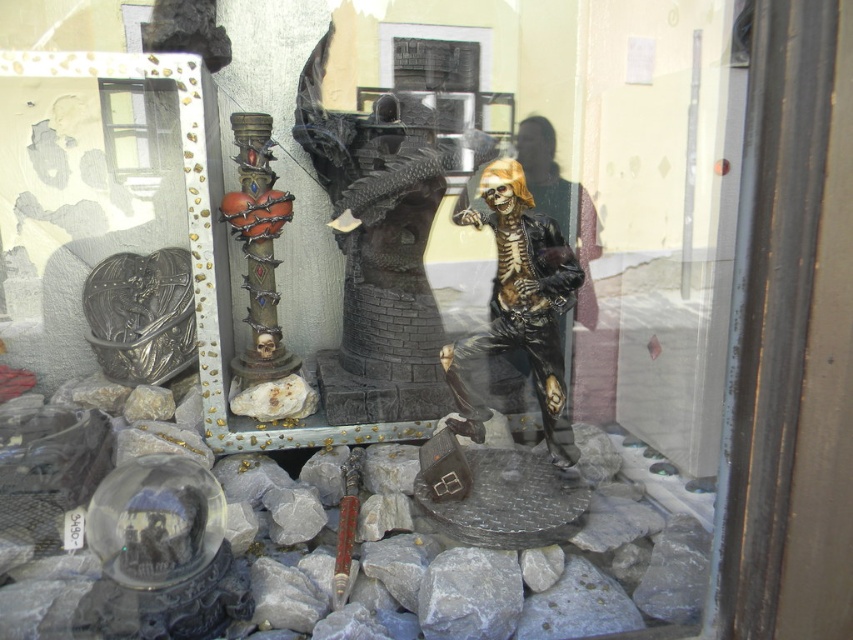
How much distance is there between silver metallic heart at left and shiny metallic column at center?

A distance of 29.37 centimeters exists between silver metallic heart at left and shiny metallic column at center.

Is point (137, 308) positioned after point (254, 116)?

That is True.

Where is `silver metallic heart at left`? The width and height of the screenshot is (853, 640). silver metallic heart at left is located at coordinates (141, 314).

Can you confirm if shiny gold skeleton at center is wider than silver metallic heart at left?

No, shiny gold skeleton at center is not wider than silver metallic heart at left.

Can you confirm if shiny gold skeleton at center is thinner than silver metallic heart at left?

Yes.

Which is behind, point (511, 212) or point (149, 328)?

The point (149, 328) is behind.

Identify the location of shiny gold skeleton at center. This screenshot has height=640, width=853. (519, 307).

Based on the photo, is shiny gold skeleton at center positioned in front of shiny metallic column at center?

Yes.

Is point (498, 320) closer to camera compared to point (260, 321)?

Yes, it is.

What do you see at coordinates (519, 307) in the screenshot? Image resolution: width=853 pixels, height=640 pixels. I see `shiny gold skeleton at center` at bounding box center [519, 307].

At what (x,y) coordinates should I click in order to perform the action: click on shiny gold skeleton at center. Please return your answer as a coordinate pair (x, y). Looking at the image, I should click on (519, 307).